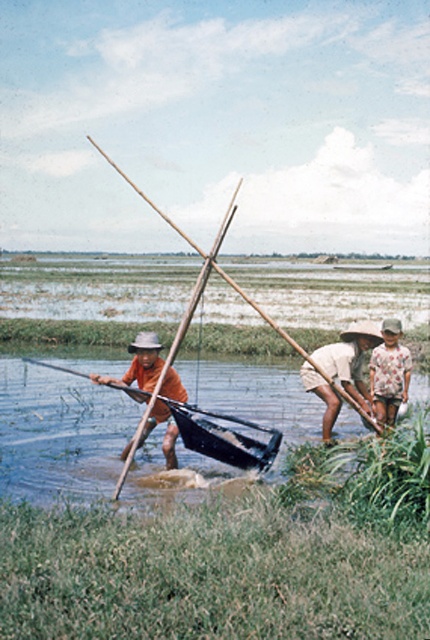
You are standing at the edge of the paddy field and see the orange fabric hat at left and the wooden stick at center. Which object is closer to the water surface?

The orange fabric hat at left is below the wooden stick at center, so the orange fabric hat at left is closer to the water surface.

You are standing at the edge of the paddy field and see the orange fabric hat at left and the wooden stick at center. Which object is shorter in height?

The orange fabric hat at left is shorter than the wooden stick at center.

You are a photographer trying to capture a closeup of the orange fabric hat at left and the floral fabric shirt at lower right. Which object should you zoom in on first to ensure it fits entirely in the frame?

The orange fabric hat at left is bigger than the floral fabric shirt at lower right, so you should zoom in on the orange fabric hat at left first to ensure it fits entirely in the frame.